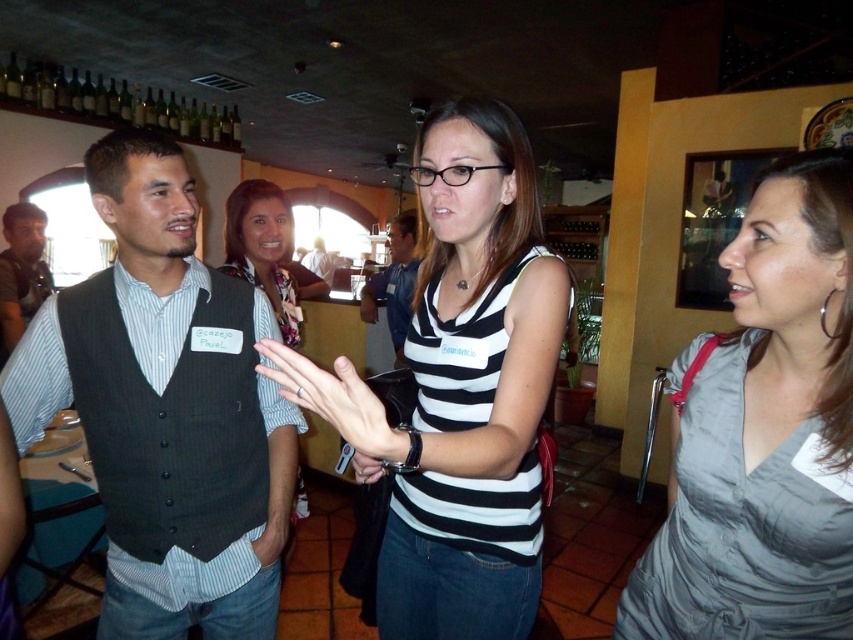
Is point (503, 577) in front of point (379, 273)?

Yes.

Which is more to the right, black and white striped tank top at center or matte black vest at center?

From the viewer's perspective, black and white striped tank top at center appears more on the right side.

Between point (389, 465) and point (395, 275), which one is positioned behind?

Positioned behind is point (395, 275).

Locate an element on the screen. black and white striped tank top at center is located at coordinates (459, 388).

Who is more distant from viewer, (x=157, y=568) or (x=415, y=282)?

The point (x=415, y=282) is behind.

Can you confirm if dark gray pinstripe vest at left is thinner than matte black vest at center?

In fact, dark gray pinstripe vest at left might be wider than matte black vest at center.

The width and height of the screenshot is (853, 640). Describe the element at coordinates (166, 408) in the screenshot. I see `dark gray pinstripe vest at left` at that location.

Locate an element on the screen. The width and height of the screenshot is (853, 640). dark gray pinstripe vest at left is located at coordinates (166, 408).

Between point (791, 282) and point (393, 220), which one is positioned in front?

Point (791, 282)

Is gray satin dress at center thinner than matte black vest at center?

Indeed, gray satin dress at center has a lesser width compared to matte black vest at center.

Is point (631, 608) positioned behind point (358, 307)?

That is False.

I want to click on gray satin dress at center, so click(x=763, y=433).